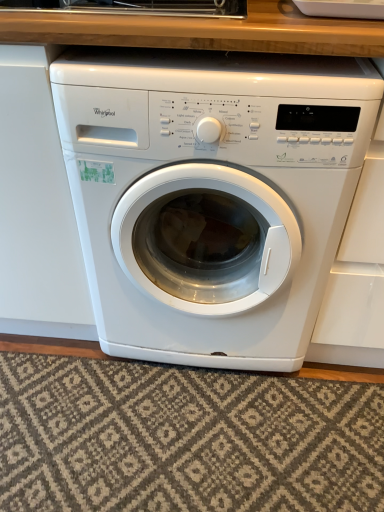
Where is `empty space that is ontop of textured beige rug at lower center (from a real-world perspective)`? empty space that is ontop of textured beige rug at lower center (from a real-world perspective) is located at coordinates pyautogui.click(x=173, y=435).